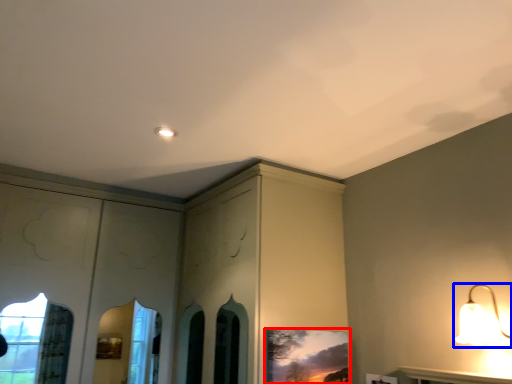
Question: Which of the following is the farthest to the observer, picture frame (highlighted by a red box) or lamp (highlighted by a blue box)?

Choices:
 (A) picture frame
 (B) lamp

Answer: (A)